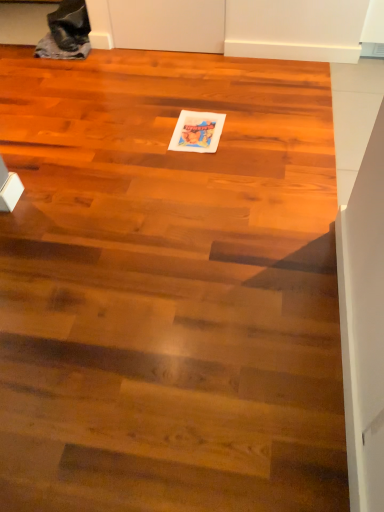
You are a GUI agent. You are given a task and a screenshot of the screen. Output one action in this format:
    pyautogui.click(x=<x>, y=<y>)
    Task: Click on the free space to the right of white paper at center
    
    Given the screenshot: What is the action you would take?
    pyautogui.click(x=248, y=129)